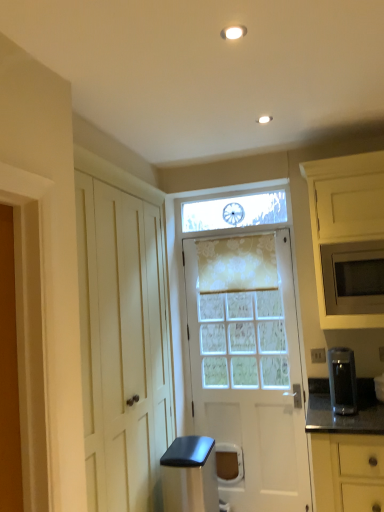
Question: Considering the positions of point (317, 257) and point (340, 362), is point (317, 257) closer or farther from the camera than point (340, 362)?

Choices:
 (A) closer
 (B) farther

Answer: (A)

Question: Based on their positions, is matte white microwave at right, which is the 1th cabinetry from top to bottom, located to the left or right of satin black coffee maker at right, which is the first appliance in top-to-bottom order?

Choices:
 (A) left
 (B) right

Answer: (B)

Question: Estimate the real-world distances between objects in this image. Which object is farther from the satin black trash can at lower center, acting as the 2th appliance starting from the right?

Choices:
 (A) floral sheer curtain at center
 (B) satin black coffee maker at right, which is the first appliance in top-to-bottom order
 (C) matte gray microwave at right
 (D) white textured door at center
 (E) matte white microwave at right, the second cabinetry ordered from the bottom

Answer: (E)

Question: Considering the real-world distances, which object is closest to the matte gray microwave at right?

Choices:
 (A) floral sheer curtain at center
 (B) satin black coffee maker at right, which is the first appliance in top-to-bottom order
 (C) satin black trash can at lower center, the first appliance from the left
 (D) matte white microwave at right, the second cabinetry ordered from the bottom
 (E) yellow matte cabinet at lower right, positioned as the 1th cabinetry in bottom-to-top order

Answer: (D)